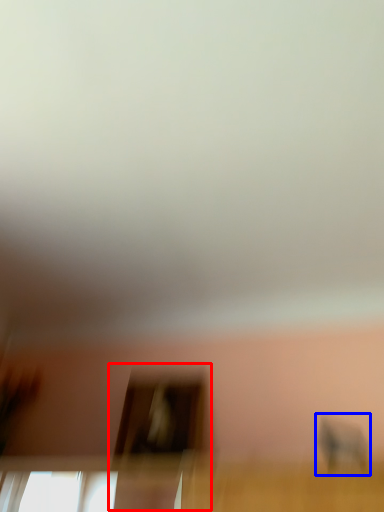
Question: Which object is closer to the camera taking this photo, screen door (highlighted by a red box) or baby elephant (highlighted by a blue box)?

Choices:
 (A) screen door
 (B) baby elephant

Answer: (B)